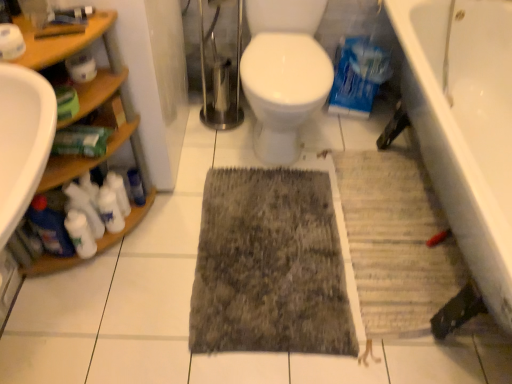
Describe the element at coordinates (11, 42) in the screenshot. The width and height of the screenshot is (512, 384). I see `white matte toilet paper at upper left, the 1th toilet paper when ordered from front to back` at that location.

Where is `gray textured bath mat at lower right`? This screenshot has width=512, height=384. gray textured bath mat at lower right is located at coordinates (396, 242).

Where is `dark gray textured rug at center`? dark gray textured rug at center is located at coordinates (269, 266).

Where is `blue glossy bottle at left, the 4th cleaning product viewed from the right`? The width and height of the screenshot is (512, 384). blue glossy bottle at left, the 4th cleaning product viewed from the right is located at coordinates (50, 228).

Identify the location of blue plastic bottle at left. The image size is (512, 384). (136, 186).

The height and width of the screenshot is (384, 512). Describe the element at coordinates (136, 186) in the screenshot. I see `blue plastic bottle at left` at that location.

Locate an element on the screen. white matte cleaning products at lower left, which is counted as the 3th cleaning product, starting from the left is located at coordinates (110, 210).

Locate an element on the screen. white matte toilet paper at upper left, the 1th toilet paper when ordered from front to back is located at coordinates click(x=11, y=42).

From the image's perspective, is white matte cleaning product at left, the 1th cleaning product from the right, positioned above or below white matte cleaning product at lower left, acting as the 2th cleaning product starting from the left?

Based on their image positions, white matte cleaning product at left, the 1th cleaning product from the right, is located above white matte cleaning product at lower left, acting as the 2th cleaning product starting from the left.

Which object is further away from the camera, white matte cleaning product at left, placed as the 4th cleaning product when sorted from left to right, or white matte cleaning product at lower left, the 3th cleaning product viewed from the right?

white matte cleaning product at left, placed as the 4th cleaning product when sorted from left to right, is more distant.

Is white matte cleaning product at left, placed as the 4th cleaning product when sorted from left to right, positioned with its back to white matte cleaning product at lower left, acting as the 2th cleaning product starting from the left?

No, white matte cleaning product at left, placed as the 4th cleaning product when sorted from left to right,'s orientation is not away from white matte cleaning product at lower left, acting as the 2th cleaning product starting from the left.

Would you say white matte cleaning product at left, placed as the 4th cleaning product when sorted from left to right, contains white matte cleaning product at lower left, acting as the 2th cleaning product starting from the left?

No, white matte cleaning product at left, placed as the 4th cleaning product when sorted from left to right, does not contain white matte cleaning product at lower left, acting as the 2th cleaning product starting from the left.

From the picture: How far apart are white matte cleaning product at lower left, acting as the 2th cleaning product starting from the left, and white matte cleaning products at lower left, which is counted as the 3th cleaning product, starting from the left?

The distance of white matte cleaning product at lower left, acting as the 2th cleaning product starting from the left, from white matte cleaning products at lower left, which is counted as the 3th cleaning product, starting from the left, is 3.91 inches.

From a real-world perspective, which object stands above the other?

From a 3D spatial view, white matte cleaning product at lower left, acting as the 2th cleaning product starting from the left, is above.

Considering the positions of objects white matte cleaning product at lower left, the 3th cleaning product viewed from the right, and white matte cleaning products at lower left, which is counted as the 3th cleaning product, starting from the left, in the image provided, who is in front, white matte cleaning product at lower left, the 3th cleaning product viewed from the right, or white matte cleaning products at lower left, which is counted as the 3th cleaning product, starting from the left,?

white matte cleaning product at lower left, the 3th cleaning product viewed from the right, is more forward.

From the image's perspective, is white matte cleaning product at lower left, acting as the 2th cleaning product starting from the left, above or below white matte cleaning products at lower left, which is the second cleaning product in right-to-left order?

→ white matte cleaning product at lower left, acting as the 2th cleaning product starting from the left, is below white matte cleaning products at lower left, which is the second cleaning product in right-to-left order.

From a real-world perspective, which object rests below the other?

In real-world perspective, blue glossy bottle at left, the first cleaning product positioned from the left, is lower.

Is blue glossy bottle at left, the first cleaning product positioned from the left, spatially inside woodenshelves at left, or outside of it?

blue glossy bottle at left, the first cleaning product positioned from the left, can be found inside woodenshelves at left.

Considering the sizes of objects blue glossy bottle at left, the 4th cleaning product viewed from the right, and woodenshelves at left in the image provided, who is thinner, blue glossy bottle at left, the 4th cleaning product viewed from the right, or woodenshelves at left?

With smaller width is blue glossy bottle at left, the 4th cleaning product viewed from the right.

What's the angular difference between blue glossy bottle at left, the first cleaning product positioned from the left, and woodenshelves at left's facing directions?

The angular difference between blue glossy bottle at left, the first cleaning product positioned from the left, and woodenshelves at left is 79.8 degrees.

You are a GUI agent. You are given a task and a screenshot of the screen. Output one action in this format:
    pyautogui.click(x=<x>, y=<y>)
    Task: Click on the toilet paper on the right side of white matte cleaning product at lower left, the 3th cleaning product viewed from the right
    The image size is (512, 384).
    Given the screenshot: What is the action you would take?
    pyautogui.click(x=81, y=67)

Is white matte cleaning product at lower left, acting as the 2th cleaning product starting from the left, positioned with its back to white matte toilet paper at upper left, marked as the 1th toilet paper in a right-to-left arrangement?

No, white matte toilet paper at upper left, marked as the 1th toilet paper in a right-to-left arrangement, is not at the back of white matte cleaning product at lower left, acting as the 2th cleaning product starting from the left.

From a real-world perspective, is white matte cleaning product at lower left, the 3th cleaning product viewed from the right, beneath white matte toilet paper at upper left, the first toilet paper viewed from the back?

Yes.

Is the depth of white matte cleaning product at lower left, acting as the 2th cleaning product starting from the left, less than that of blue glossy bottle at left, the 4th cleaning product viewed from the right?

No, it is behind blue glossy bottle at left, the 4th cleaning product viewed from the right.

Can you confirm if white matte cleaning product at lower left, the 3th cleaning product viewed from the right, is shorter than blue glossy bottle at left, the first cleaning product positioned from the left?

Yes.

How many degrees apart are the facing directions of white matte cleaning product at lower left, acting as the 2th cleaning product starting from the left, and blue glossy bottle at left, the 4th cleaning product viewed from the right?

white matte cleaning product at lower left, acting as the 2th cleaning product starting from the left, and blue glossy bottle at left, the 4th cleaning product viewed from the right, are facing 29.6 degrees away from each other.

From the image's perspective, is white matte cleaning product at lower left, the 3th cleaning product viewed from the right, on blue glossy bottle at left, the first cleaning product positioned from the left?

Actually, white matte cleaning product at lower left, the 3th cleaning product viewed from the right, appears below blue glossy bottle at left, the first cleaning product positioned from the left, in the image.

Does white matte cleaning product at lower left, the 3th cleaning product viewed from the right, turn towards blue plastic bottle at left?

No, white matte cleaning product at lower left, the 3th cleaning product viewed from the right, is not oriented towards blue plastic bottle at left.

Does point (85, 252) appear closer or farther from the camera than point (141, 195)?

Clearly, point (85, 252) is closer to the camera than point (141, 195).

Is there a large distance between white matte cleaning product at lower left, acting as the 2th cleaning product starting from the left, and blue plastic bottle at left?

No, white matte cleaning product at lower left, acting as the 2th cleaning product starting from the left, is not far away from blue plastic bottle at left.

Is gray textured bath mat at lower right in front of white matte cleaning product at lower left, acting as the 2th cleaning product starting from the left?

No.

From the picture: Which is further, (414,202) or (81,244)?

Positioned behind is point (414,202).

Could you tell me if gray textured bath mat at lower right is facing white matte cleaning product at lower left, the 3th cleaning product viewed from the right?

No, gray textured bath mat at lower right is not turned towards white matte cleaning product at lower left, the 3th cleaning product viewed from the right.

From the image's perspective, count 3rd cleaning products upward from the white matte cleaning product at lower left, acting as the 2th cleaning product starting from the left, and point to it. Please provide its 2D coordinates.

[(118, 192)]

Identify the location of cleaning product that is the 2nd object directly below the white matte cleaning product at lower left, the 3th cleaning product viewed from the right (from a real-world perspective). (110, 210).

Which object lies further to the anchor point white matte toilet paper at upper left, the 1th toilet paper when ordered from front to back, gray textured bath mat at lower right or blue glossy bottle at left, the first cleaning product positioned from the left?

gray textured bath mat at lower right lies further to white matte toilet paper at upper left, the 1th toilet paper when ordered from front to back, than the other object.

From the image, which object appears to be nearer to white matte cleaning product at lower left, acting as the 2th cleaning product starting from the left, blue glossy bottle at left, the 4th cleaning product viewed from the right, or white matte cleaning product at left, the 1th cleaning product from the right?

Based on the image, blue glossy bottle at left, the 4th cleaning product viewed from the right, appears to be nearer to white matte cleaning product at lower left, acting as the 2th cleaning product starting from the left.

Considering their positions, is white matte cleaning product at left, the 1th cleaning product from the right, positioned closer to white matte cleaning product at lower left, the 3th cleaning product viewed from the right, than white ceramic bathtub at lower right?

white matte cleaning product at left, the 1th cleaning product from the right.

Which object lies nearer to the anchor point white matte cleaning products at lower left, which is counted as the 3th cleaning product, starting from the left, blue plastic bottle at left or white matte cleaning product at lower left, acting as the 2th cleaning product starting from the left?

white matte cleaning product at lower left, acting as the 2th cleaning product starting from the left, is positioned closer to the anchor white matte cleaning products at lower left, which is counted as the 3th cleaning product, starting from the left.

Estimate the real-world distances between objects in this image. Which object is further from white matte toilet paper at upper left, acting as the second toilet paper starting from the right, blue glossy bottle at left, the 4th cleaning product viewed from the right, or white matte cleaning product at left, the 1th cleaning product from the right?

white matte cleaning product at left, the 1th cleaning product from the right, is further to white matte toilet paper at upper left, acting as the second toilet paper starting from the right.

Which object lies nearer to the anchor point white matte cleaning product at left, placed as the 4th cleaning product when sorted from left to right, dark gray textured rug at center or white matte toilet paper at upper left, the first toilet paper viewed from the left?

dark gray textured rug at center is positioned closer to the anchor white matte cleaning product at left, placed as the 4th cleaning product when sorted from left to right.

From the image, which object appears to be farther from white matte toilet paper at upper left, acting as the second toilet paper starting from the right, white matte toilet paper at upper left, marked as the 1th toilet paper in a right-to-left arrangement, or blue plastic bottle at left?

blue plastic bottle at left is further to white matte toilet paper at upper left, acting as the second toilet paper starting from the right.

From the image, which object appears to be farther from blue plastic bottle at left, white matte cleaning products at lower left, which is the second cleaning product in right-to-left order, or white ceramic bathtub at lower right?

white ceramic bathtub at lower right lies further to blue plastic bottle at left than the other object.

At what (x,y) coordinates should I click in order to perform the action: click on toiletry located between blue glossy bottle at left, the first cleaning product positioned from the left, and dark gray textured rug at center in the left-right direction. Please return your answer as a coordinate pair (x, y). Looking at the image, I should click on (136, 186).

Where is `toilet paper situated between white matte cleaning product at lower left, acting as the 2th cleaning product starting from the left, and white ceramic bathtub at lower right from left to right`? Image resolution: width=512 pixels, height=384 pixels. toilet paper situated between white matte cleaning product at lower left, acting as the 2th cleaning product starting from the left, and white ceramic bathtub at lower right from left to right is located at coordinates (81, 67).

Locate an element on the screen. This screenshot has height=384, width=512. doormat between white matte cleaning product at lower left, acting as the 2th cleaning product starting from the left, and gray textured bath mat at lower right, in the horizontal direction is located at coordinates (269, 266).

This screenshot has width=512, height=384. What are the coordinates of `shelf situated between blue glossy bottle at left, the 4th cleaning product viewed from the right, and gray textured bath mat at lower right from left to right` in the screenshot? It's located at (92, 109).